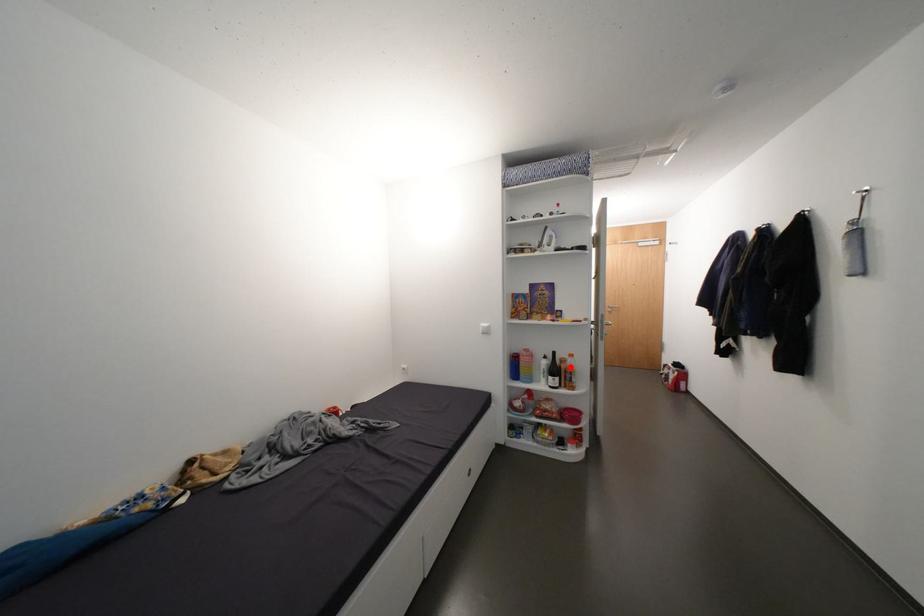
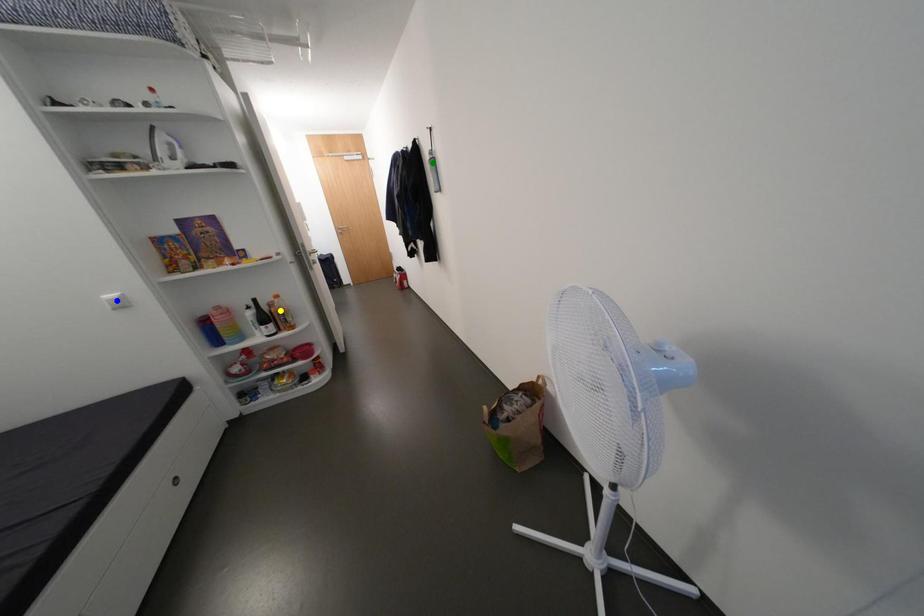
Question: I am providing you with two images of the same scene from different viewpoints. A red point is marked on the first image. You are given multiple points on the second image. Which point in image 2 represents the same 3d spot as the red point in image 1?

Choices:
 (A) blue point
 (B) green point
 (C) yellow point

Answer: (C)